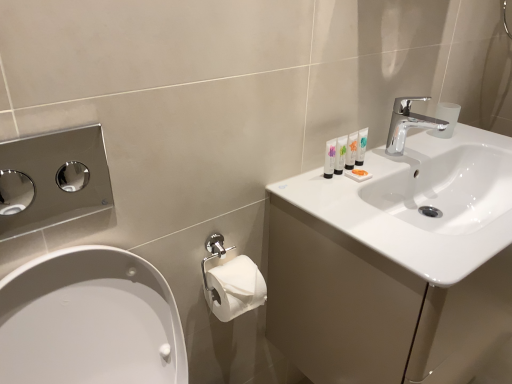
Question: Considering their positions, is white glossy tube at upper right, which is the 3th mouthwash in left-to-right order, located in front of or behind translucent plastic tubes at upper right, placed as the 4th mouthwash when sorted from left to right?

Choices:
 (A) behind
 (B) front

Answer: (B)

Question: Is point (350, 137) closer or farther from the camera than point (360, 147)?

Choices:
 (A) farther
 (B) closer

Answer: (B)

Question: Which of these objects is positioned closest to the polished chrome hand dryer at left?

Choices:
 (A) white glossy sink at upper right
 (B) white glossy tube at upper right, which is the 3th mouthwash in left-to-right order
 (C) white glossy sink at upper right
 (D) white glossy tubes at upper right, which ranks as the 4th mouthwash in right-to-left order
 (E) translucent plastic tubes at upper right, the third mouthwash from the right

Answer: (C)

Question: Which is nearer to the white glossy tubes at upper right, the first mouthwash when ordered from left to right?

Choices:
 (A) white glossy sink at upper right
 (B) translucent plastic tubes at upper right, placed as the 4th mouthwash when sorted from left to right
 (C) polished chrome hand dryer at left
 (D) chrome metallic faucet at upper right
 (E) white glossy sink at upper right

Answer: (B)